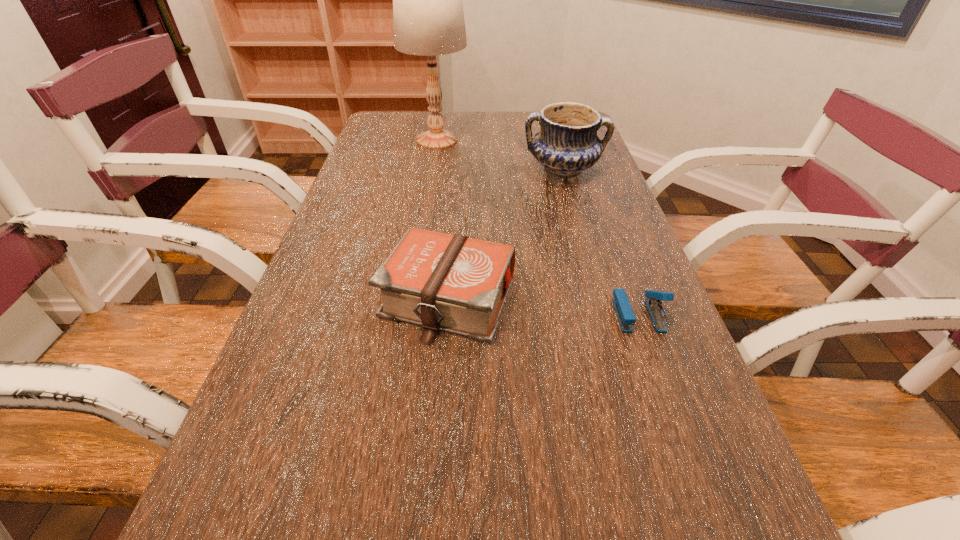
This screenshot has height=540, width=960. In order to click on lamp in this screenshot , I will do `click(428, 16)`.

At what (x,y) coordinates should I click in order to perform the action: click on the second tallest object. Please return your answer as a coordinate pair (x, y). This screenshot has width=960, height=540. Looking at the image, I should click on (567, 143).

Where is `Bible`? The image size is (960, 540). Bible is located at coordinates pos(453,283).

This screenshot has width=960, height=540. Identify the location of stapler. (626, 318).

I want to click on blank area located on the right of the tallest object, so click(x=522, y=140).

You are a GUI agent. You are given a task and a screenshot of the screen. Output one action in this format:
    pyautogui.click(x=<x>, y=<y>)
    Task: Click on the vacant space located 0.370m on the front of the third shortest object
    Image resolution: width=960 pixels, height=540 pixels.
    Given the screenshot: What is the action you would take?
    pyautogui.click(x=593, y=275)

At what (x,y) coordinates should I click in order to perform the action: click on blank space located on the back of the Bible. Please return your answer as a coordinate pair (x, y). The width and height of the screenshot is (960, 540). Looking at the image, I should click on (455, 210).

Image resolution: width=960 pixels, height=540 pixels. What are the coordinates of `free space located 0.400m on the back of the stapler` in the screenshot? It's located at [x=595, y=195].

Locate an element on the screen. object present at the far edge is located at coordinates (428, 16).

This screenshot has width=960, height=540. Identify the location of object present at the left edge. (428, 16).